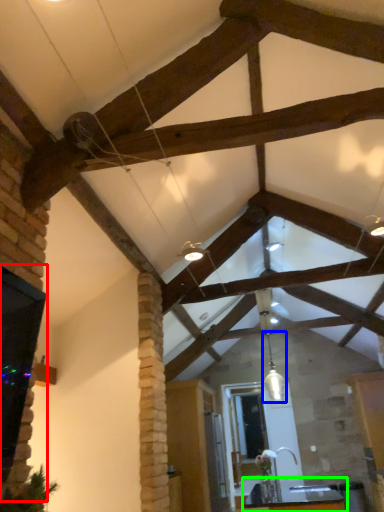
Question: Which object is positioned farthest from window (highlighted by a red box)? Select from light fixture (highlighted by a blue box) and table (highlighted by a green box).

Choices:
 (A) light fixture
 (B) table

Answer: (B)